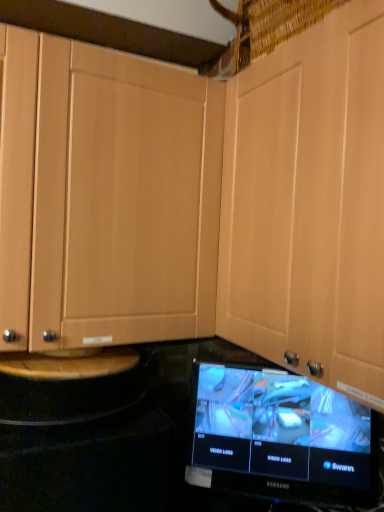
Consider the image. What is the approximate width of matte wood cabinet at center?

The width of matte wood cabinet at center is 38.80 centimeters.

The image size is (384, 512). Identify the location of matte wood cabinet at center. 309,203.

Measure the distance between point (237, 203) and camera.

3.69 feet.

Describe the element at coordinates (309, 203) in the screenshot. I see `matte wood cabinet at center` at that location.

Find the location of a particular element. This screenshot has height=512, width=384. black glossy monitor at lower center is located at coordinates point(280,437).

What do you see at coordinates (280, 437) in the screenshot? The width and height of the screenshot is (384, 512). I see `black glossy monitor at lower center` at bounding box center [280, 437].

Find the location of a particular element. matte wood cabinet at center is located at coordinates (309, 203).

Considering the positions of objects black glossy monitor at lower center and matte wood cabinet at center in the image provided, who is more to the right, black glossy monitor at lower center or matte wood cabinet at center?

matte wood cabinet at center is more to the right.

Considering the positions of objects black glossy monitor at lower center and matte wood cabinet at center in the image provided, who is behind, black glossy monitor at lower center or matte wood cabinet at center?

black glossy monitor at lower center.

Is point (206, 365) closer or farther from the camera than point (289, 273)?

Point (206, 365) appears to be farther away from the viewer than point (289, 273).

From the image's perspective, between black glossy monitor at lower center and matte wood cabinet at center, who is located below?

black glossy monitor at lower center is shown below in the image.

From a real-world perspective, is black glossy monitor at lower center physically located above or below matte wood cabinet at center?

From a real-world perspective, black glossy monitor at lower center is physically below matte wood cabinet at center.

Considering the sizes of objects black glossy monitor at lower center and matte wood cabinet at center in the image provided, who is wider, black glossy monitor at lower center or matte wood cabinet at center?

matte wood cabinet at center.

Is black glossy monitor at lower center taller than matte wood cabinet at center?

In fact, black glossy monitor at lower center may be shorter than matte wood cabinet at center.

Can you confirm if black glossy monitor at lower center is bigger than matte wood cabinet at center?

Actually, black glossy monitor at lower center might be smaller than matte wood cabinet at center.

Is black glossy monitor at lower center situated inside matte wood cabinet at center or outside?

black glossy monitor at lower center cannot be found inside matte wood cabinet at center.

Does black glossy monitor at lower center touch matte wood cabinet at center?

No, black glossy monitor at lower center is not next to matte wood cabinet at center.

Does black glossy monitor at lower center turn towards matte wood cabinet at center?

No, black glossy monitor at lower center is not turned towards matte wood cabinet at center.

How far apart are black glossy monitor at lower center and matte wood cabinet at center?

black glossy monitor at lower center and matte wood cabinet at center are 13.43 inches apart from each other.

Where is `cabinetry positioned vertically above the black glossy monitor at lower center (from a real-world perspective)`? The image size is (384, 512). cabinetry positioned vertically above the black glossy monitor at lower center (from a real-world perspective) is located at coordinates (309, 203).

Can you confirm if matte wood cabinet at center is positioned to the left of black glossy monitor at lower center?

No, matte wood cabinet at center is not to the left of black glossy monitor at lower center.

Considering their positions, is matte wood cabinet at center located in front of or behind black glossy monitor at lower center?

Visually, matte wood cabinet at center is located in front of black glossy monitor at lower center.

Is point (370, 71) positioned in front of point (374, 433)?

Yes.

From the image's perspective, is matte wood cabinet at center on black glossy monitor at lower center?

Yes, from the image's perspective, matte wood cabinet at center is over black glossy monitor at lower center.

From a real-world perspective, which is physically above, matte wood cabinet at center or black glossy monitor at lower center?

matte wood cabinet at center.

Considering the sizes of matte wood cabinet at center and black glossy monitor at lower center in the image, is matte wood cabinet at center wider or thinner than black glossy monitor at lower center?

Considering their sizes, matte wood cabinet at center looks broader than black glossy monitor at lower center.

Considering the relative sizes of matte wood cabinet at center and black glossy monitor at lower center in the image provided, is matte wood cabinet at center shorter than black glossy monitor at lower center?

No, matte wood cabinet at center is not shorter than black glossy monitor at lower center.

Who is smaller, matte wood cabinet at center or black glossy monitor at lower center?

With smaller size is black glossy monitor at lower center.

Is matte wood cabinet at center inside the boundaries of black glossy monitor at lower center, or outside?

matte wood cabinet at center is outside black glossy monitor at lower center.

Is matte wood cabinet at center beside black glossy monitor at lower center?

No.

Does matte wood cabinet at center turn towards black glossy monitor at lower center?

No, matte wood cabinet at center is not turned towards black glossy monitor at lower center.

How different are the orientations of matte wood cabinet at center and black glossy monitor at lower center in degrees?

The facing directions of matte wood cabinet at center and black glossy monitor at lower center are 52.5 degrees apart.

Measure the distance between matte wood cabinet at center and black glossy monitor at lower center.

matte wood cabinet at center is 13.43 inches away from black glossy monitor at lower center.

The image size is (384, 512). In order to click on television located underneath the matte wood cabinet at center (from a real-world perspective) in this screenshot , I will do `click(280, 437)`.

Identify the location of television beneath the matte wood cabinet at center (from a real-world perspective). (280, 437).

Locate an element on the screen. This screenshot has height=512, width=384. cabinetry lying above the black glossy monitor at lower center (from the image's perspective) is located at coordinates (309, 203).